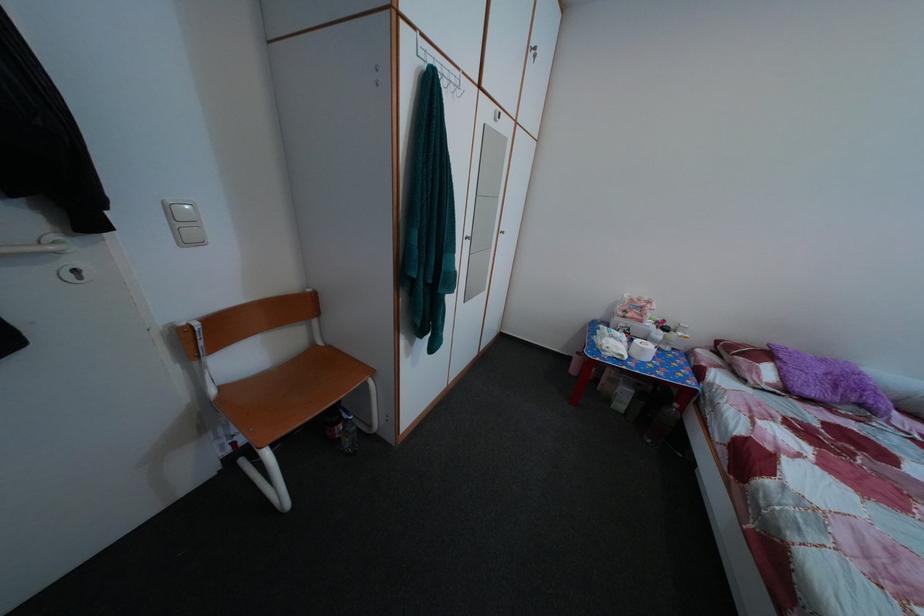
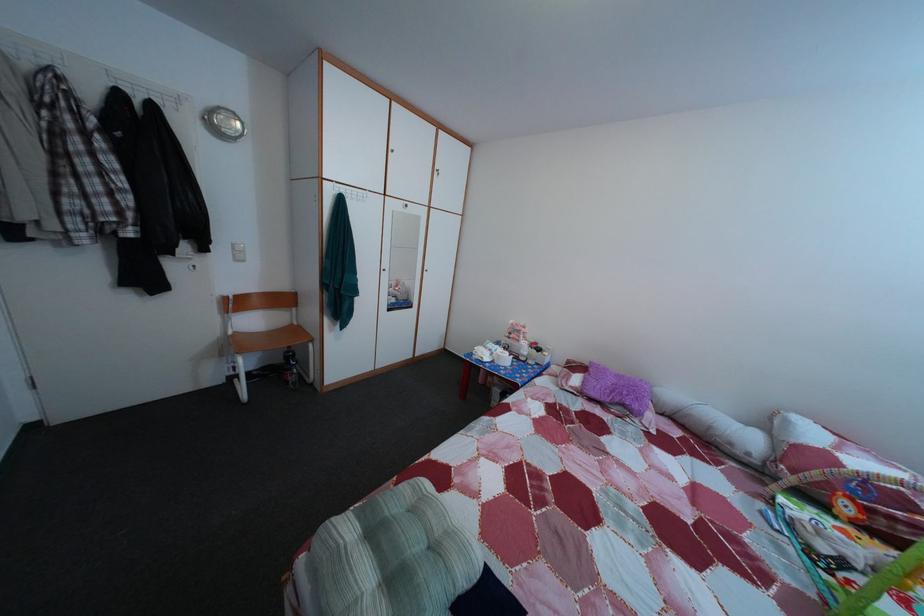
In a continuous first-person perspective shot, in which direction is the camera moving?

The cameraman walked toward right, backward.